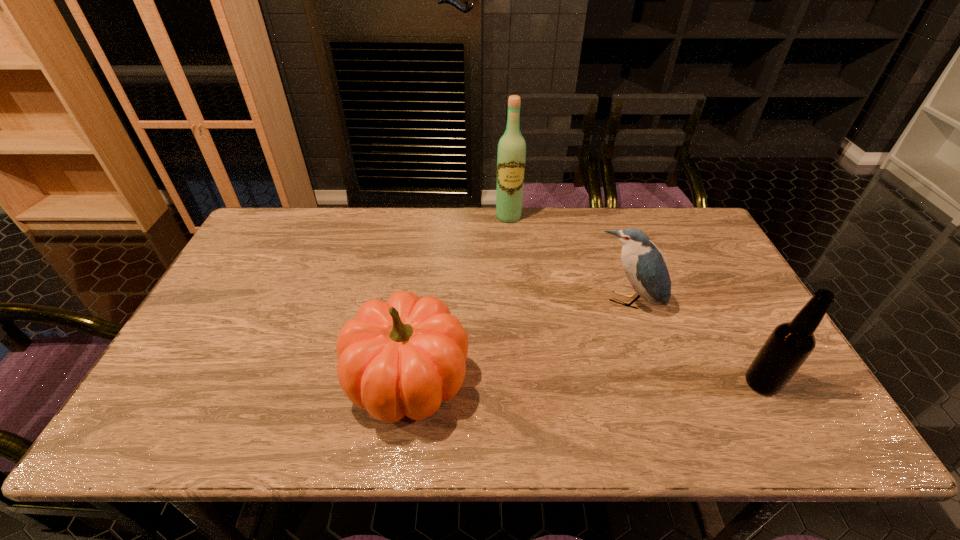
Find the location of a particular element. The height and width of the screenshot is (540, 960). the leftmost object is located at coordinates (403, 357).

The image size is (960, 540). In order to click on beer bottle in this screenshot , I will do `click(789, 345)`.

You are a GUI agent. You are given a task and a screenshot of the screen. Output one action in this format:
    pyautogui.click(x=<x>, y=<y>)
    Task: Click on the third nearest object
    Image resolution: width=960 pixels, height=540 pixels.
    Given the screenshot: What is the action you would take?
    pyautogui.click(x=644, y=266)

At what (x,y) coordinates should I click in order to perform the action: click on bird. Please return your answer as a coordinate pair (x, y). Looking at the image, I should click on (644, 266).

Where is `the farthest object`? The height and width of the screenshot is (540, 960). the farthest object is located at coordinates (511, 156).

In order to click on the third object from right to left in this screenshot , I will do `click(511, 156)`.

The image size is (960, 540). What are the coordinates of `vacant area situated on the left of the pumpkin` in the screenshot? It's located at (222, 380).

The image size is (960, 540). Find the location of `vacant space located 0.380m on the left of the beer bottle`. vacant space located 0.380m on the left of the beer bottle is located at coordinates (586, 383).

Locate an element on the screen. Image resolution: width=960 pixels, height=540 pixels. free location located at the tip of the third object from left to right's beak is located at coordinates (592, 387).

You are a GUI agent. You are given a task and a screenshot of the screen. Output one action in this format:
    pyautogui.click(x=<x>, y=<y>)
    Task: Click on the vacant space located at the tip of the third object from left to right's beak
    Image resolution: width=960 pixels, height=540 pixels.
    Given the screenshot: What is the action you would take?
    pyautogui.click(x=598, y=371)